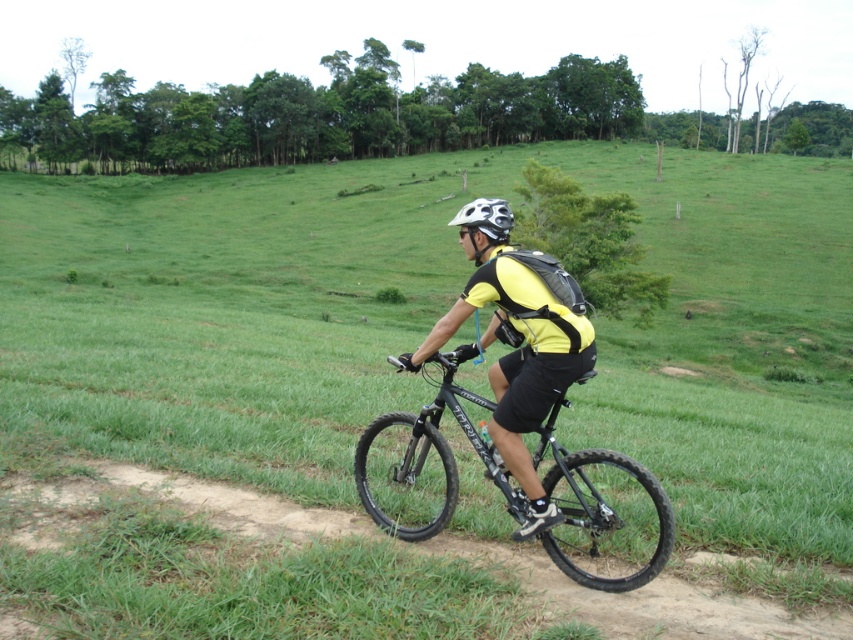
You are a photographer trying to capture the rider and their bike in the scene. Since you want to emphasize the rider, you need to know which object is shorter so you can position them accordingly. Which is shorter between the black matte bicycle at center and the matte black bicycle at center?

The black matte bicycle at center is not as tall as the matte black bicycle at center, so the black matte bicycle at center is shorter.

You are a photographer trying to capture the rider and both bicycles in the scene. Since the black matte bicycle at center and the matte black bicycle at center are positioned close to each other, which one would appear closer to the camera in your photo?

The black matte bicycle at center appears closer to the camera because it is positioned in front of the matte black bicycle at center.

You are standing at the point marked as point (604, 515) on the black matte bicycle at center. If you look directly forward, what direction would you be facing relative to the forest in the background?

Since the point (604, 515) is on the black matte bicycle at center, and the forest is in the background behind the rider, facing forward would mean looking away from the forest towards the open field.